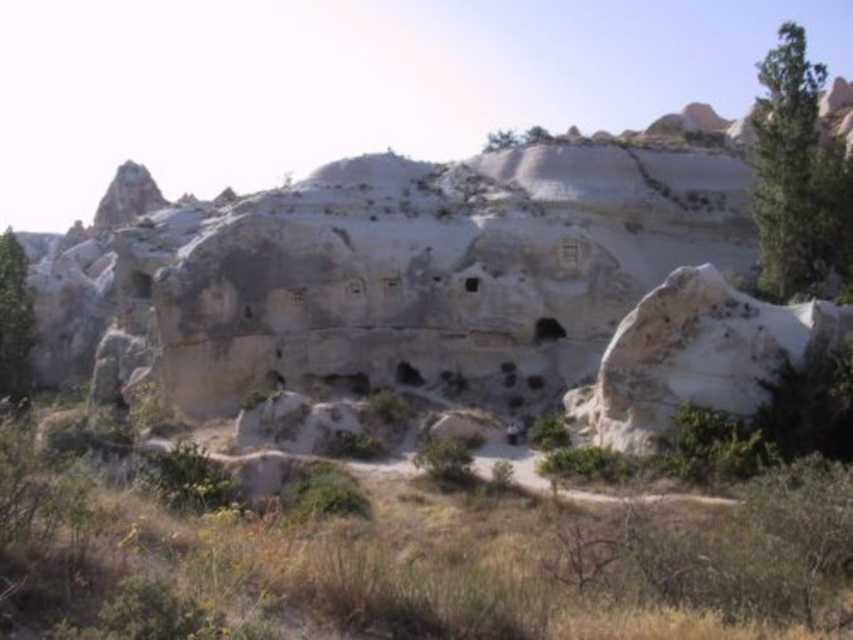
Question: Considering the relative positions of white rock formation at center and green leafy bush at center in the image provided, where is white rock formation at center located with respect to green leafy bush at center?

Choices:
 (A) right
 (B) left

Answer: (B)

Question: Which of the following is the farthest from the observer?

Choices:
 (A) (759, 68)
 (B) (433, 465)
 (C) (9, 275)

Answer: (C)

Question: Can you confirm if white rock formation at center is wider than green leafy tree at left?

Choices:
 (A) no
 (B) yes

Answer: (B)

Question: Which object appears farthest from the camera in this image?

Choices:
 (A) green leafy bush at center
 (B) white rock formation at center
 (C) green leafy tree at left
 (D) green leafy tree at upper right

Answer: (C)

Question: Which object appears farthest from the camera in this image?

Choices:
 (A) green leafy bush at center
 (B) green leafy tree at left

Answer: (B)

Question: From the image, what is the correct spatial relationship of white rock formation at center in relation to green leafy tree at upper right?

Choices:
 (A) left
 (B) right

Answer: (A)